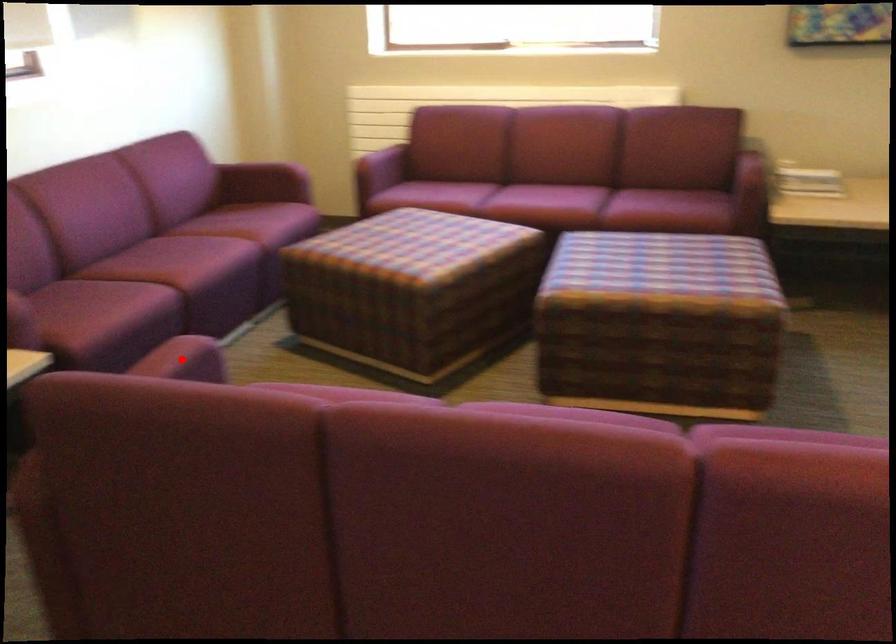
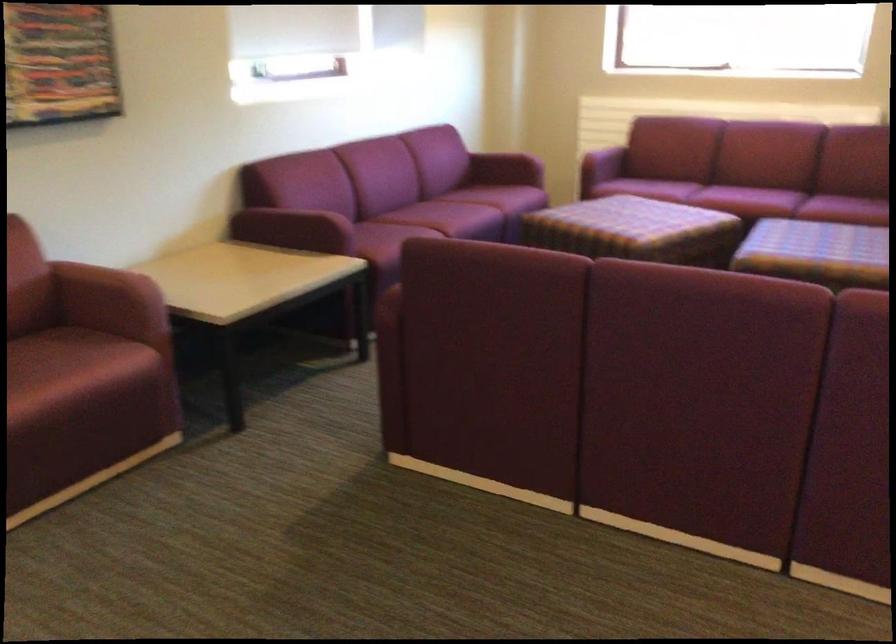
Question: I am providing you with two images of the same scene from different viewpoints. A red point is marked on the first image. Is the red point's position out of view in image 2?

Choices:
 (A) Yes
 (B) No

Answer: (A)